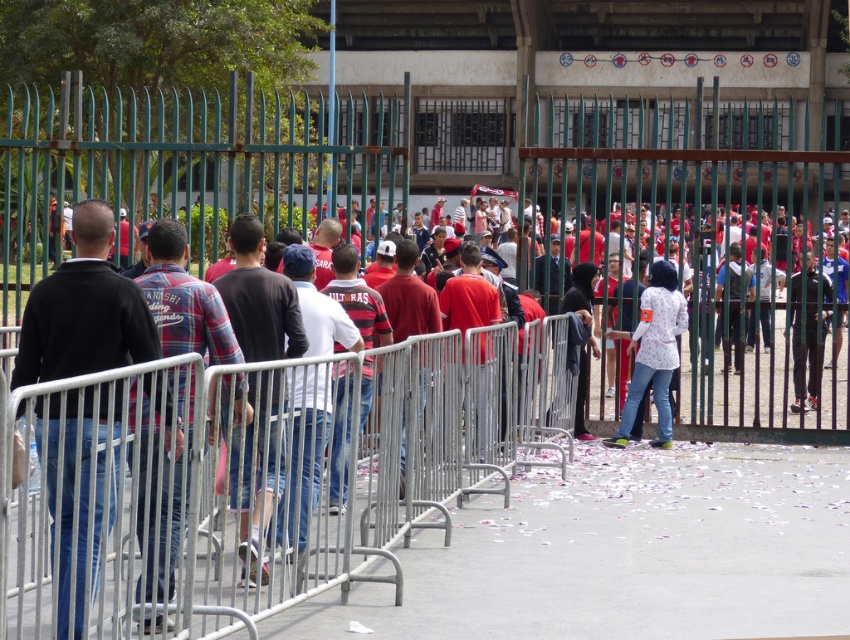
Question: Does silver metallic rail at center have a larger size compared to plaid shirt at center?

Choices:
 (A) yes
 (B) no

Answer: (A)

Question: Where is black sweater at left located in relation to dark blue jeans at center in the image?

Choices:
 (A) right
 (B) left

Answer: (B)

Question: Which point is closer to the camera taking this photo?

Choices:
 (A) (258, 346)
 (B) (227, 536)
 (C) (112, 280)

Answer: (C)

Question: Is matte black jacket at center thinner than white matte shirt at center?

Choices:
 (A) yes
 (B) no

Answer: (B)

Question: Among these points, which one is nearest to the camera?

Choices:
 (A) (89, 208)
 (B) (302, 390)

Answer: (A)

Question: Among these objects, which one is nearest to the camera?

Choices:
 (A) black matte jacket at center
 (B) dark blue jeans at center
 (C) black sweater at left
 (D) matte black jacket at center

Answer: (D)